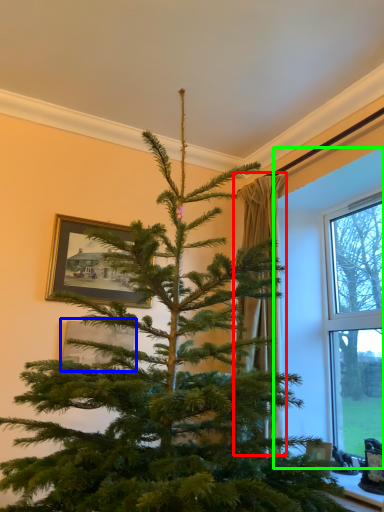
Question: Which is farther away from curtain (highlighted by a red box)? picture frame (highlighted by a blue box) or window frame (highlighted by a green box)?

Choices:
 (A) picture frame
 (B) window frame

Answer: (A)